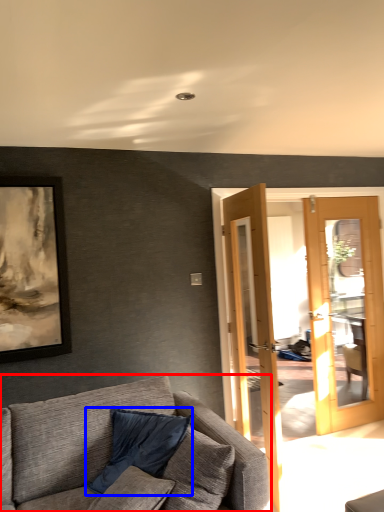
Question: Which point is further to the camera, studio couch (highlighted by a red box) or pillow (highlighted by a blue box)?

Choices:
 (A) studio couch
 (B) pillow

Answer: (B)